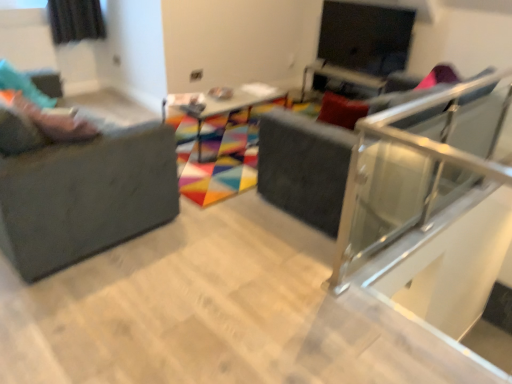
Question: Does matte pink shoes at left lie in front of wooden table at center?

Choices:
 (A) yes
 (B) no

Answer: (A)

Question: Is matte pink shoes at left facing away from wooden table at center?

Choices:
 (A) yes
 (B) no

Answer: (B)

Question: Is matte pink shoes at left to the right of wooden table at center from the viewer's perspective?

Choices:
 (A) no
 (B) yes

Answer: (A)

Question: Is matte pink shoes at left not near wooden table at center?

Choices:
 (A) yes
 (B) no

Answer: (A)

Question: Considering the relative sizes of matte pink shoes at left and wooden table at center in the image provided, is matte pink shoes at left taller than wooden table at center?

Choices:
 (A) no
 (B) yes

Answer: (A)

Question: Does matte pink shoes at left have a lesser width compared to wooden table at center?

Choices:
 (A) no
 (B) yes

Answer: (B)

Question: Could matte black swivel chair at center be considered to be inside matte pink shoes at left?

Choices:
 (A) yes
 (B) no

Answer: (B)

Question: Is matte pink shoes at left taller than matte black swivel chair at center?

Choices:
 (A) no
 (B) yes

Answer: (A)

Question: Considering the relative sizes of matte pink shoes at left and matte black swivel chair at center in the image provided, is matte pink shoes at left thinner than matte black swivel chair at center?

Choices:
 (A) no
 (B) yes

Answer: (B)

Question: From the image's perspective, is matte pink shoes at left on top of matte black swivel chair at center?

Choices:
 (A) no
 (B) yes

Answer: (B)

Question: Is matte pink shoes at left to the left of matte black swivel chair at center from the viewer's perspective?

Choices:
 (A) no
 (B) yes

Answer: (B)

Question: Is matte pink shoes at left not inside matte black swivel chair at center?

Choices:
 (A) yes
 (B) no

Answer: (A)

Question: Is matte gray studio couch at left facing towards matte black screen at upper right?

Choices:
 (A) yes
 (B) no

Answer: (A)